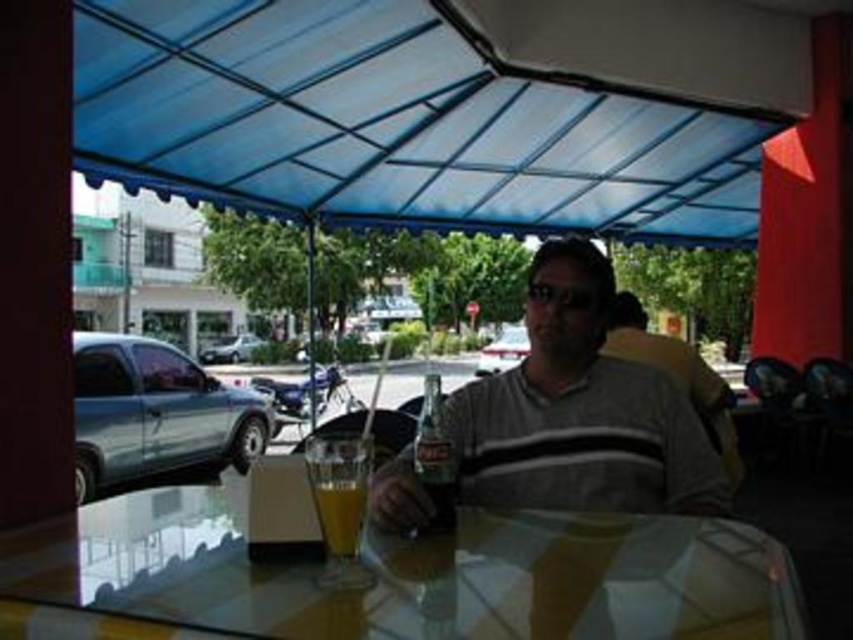
Is the position of blue fabric canopy at upper center less distant than that of transparent glass table at center?

No.

What do you see at coordinates (444, 109) in the screenshot? I see `blue fabric canopy at upper center` at bounding box center [444, 109].

I want to click on blue fabric canopy at upper center, so click(444, 109).

Does transparent glass table at center have a greater height compared to translucent glass cup at table center?

In fact, transparent glass table at center may be shorter than translucent glass cup at table center.

Can you confirm if transparent glass table at center is positioned to the left of translucent glass cup at table center?

Correct, you'll find transparent glass table at center to the left of translucent glass cup at table center.

Locate an element on the screen. This screenshot has height=640, width=853. transparent glass table at center is located at coordinates (416, 573).

What do you see at coordinates (579, 412) in the screenshot?
I see `gray cotton shirt at center` at bounding box center [579, 412].

Can you confirm if gray cotton shirt at center is wider than translucent glass cup at table center?

Yes.

What do you see at coordinates (579, 412) in the screenshot?
I see `gray cotton shirt at center` at bounding box center [579, 412].

Image resolution: width=853 pixels, height=640 pixels. Find the location of `gray cotton shirt at center`. gray cotton shirt at center is located at coordinates (579, 412).